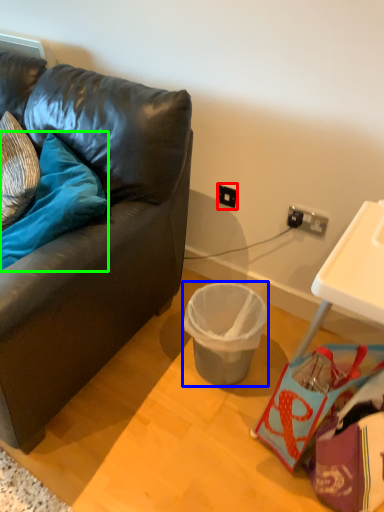
Question: Estimate the real-world distances between objects in this image. Which object is farther from power outlet (highlighted by a red box), trash bin/can (highlighted by a blue box) or pillow (highlighted by a green box)?

Choices:
 (A) trash bin/can
 (B) pillow

Answer: (B)